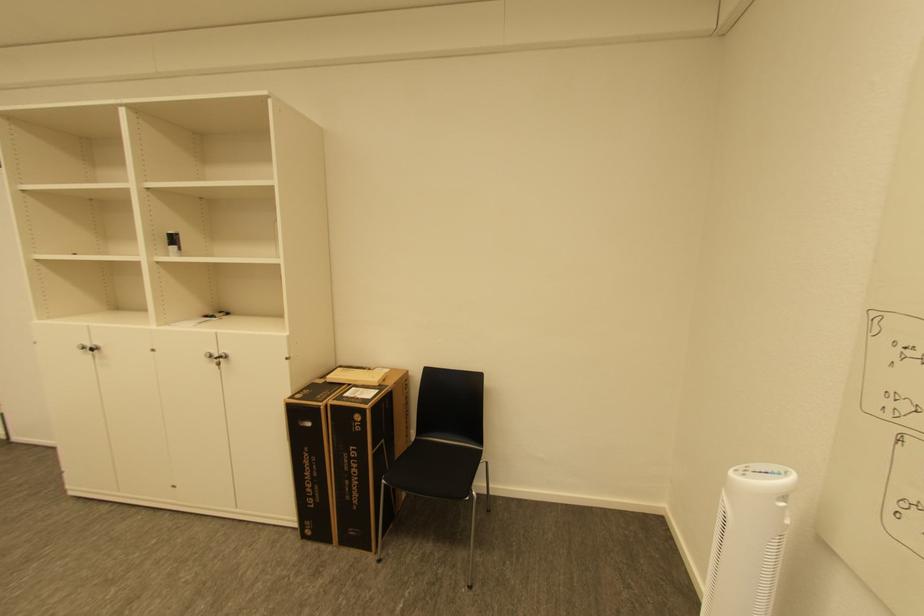
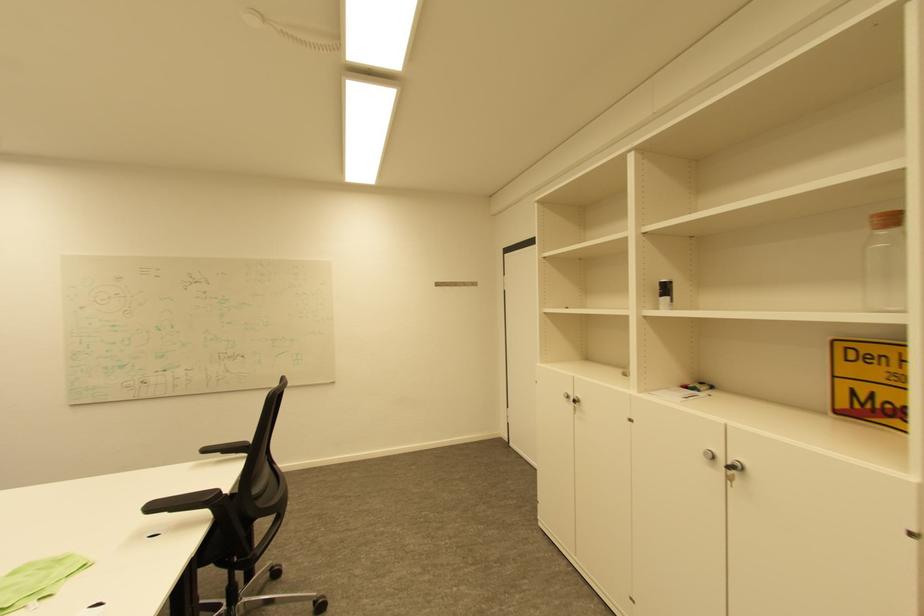
Where in the second image is the point corresponding to point 233,357 from the first image?

(748, 469)